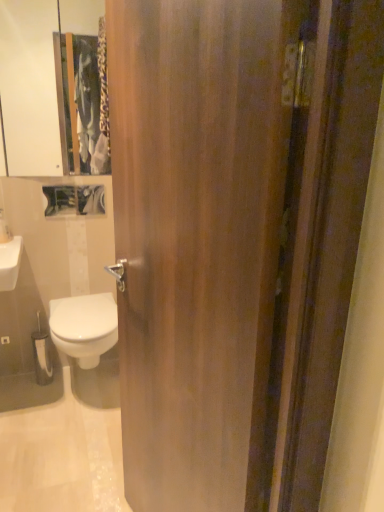
Question: Based on their positions, is wooden door at center located to the left or right of white glossy bidet at lower left?

Choices:
 (A) left
 (B) right

Answer: (B)

Question: From the image's perspective, is wooden door at center above or below white glossy bidet at lower left?

Choices:
 (A) below
 (B) above

Answer: (B)

Question: Which is farther from the wooden door at center?

Choices:
 (A) white glossy soap dispenser at upper left
 (B) white glossy bidet at lower left
 (C) white glossy medicine cabinet at upper left

Answer: (C)

Question: Considering the real-world distances, which object is farthest from the white glossy bidet at lower left?

Choices:
 (A) wooden door at center
 (B) white glossy soap dispenser at upper left
 (C) white glossy medicine cabinet at upper left

Answer: (C)